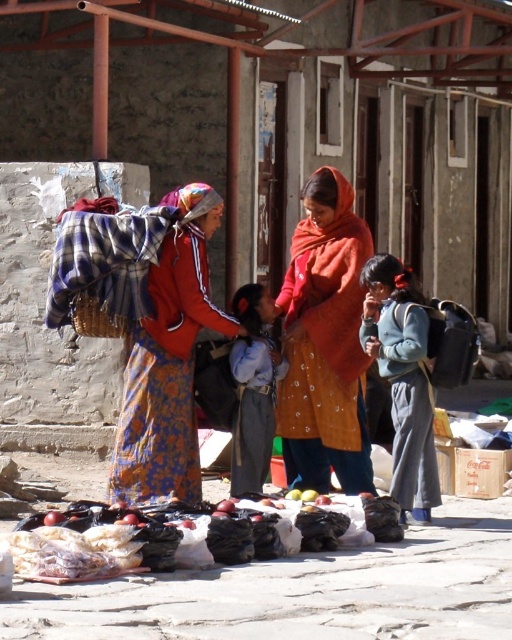
Question: Among these points, which one is nearest to the camera?

Choices:
 (A) (306, 496)
 (B) (128, 532)
 (C) (57, 513)

Answer: (B)

Question: Considering the real-world distances, which object is farthest from the yellow matte apple at center?

Choices:
 (A) shiny red apple at center
 (B) orange fabric shawl at center

Answer: (B)

Question: Which point is closer to the camera?

Choices:
 (A) blue fabric shirt at center
 (B) matte red jacket at center
 (C) blue denim jacket at center

Answer: (C)

Question: Is matte red jacket at center above shiny plastic bags at lower center?

Choices:
 (A) no
 (B) yes

Answer: (B)

Question: Is matte red jacket at center wider than shiny plastic bags at lower center?

Choices:
 (A) yes
 (B) no

Answer: (B)

Question: From the image, what is the correct spatial relationship of blue fabric shirt at center in relation to shiny red apple at center?

Choices:
 (A) below
 (B) above

Answer: (B)